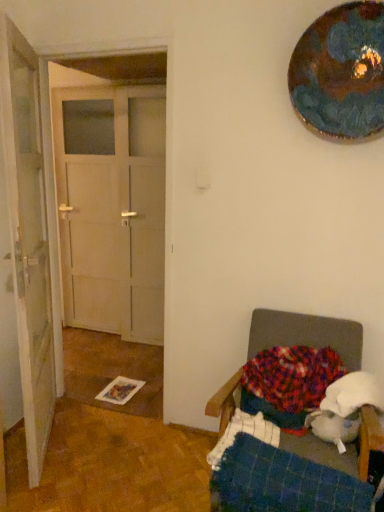
What do you see at coordinates (112, 213) in the screenshot? I see `white matte door at left, the second door viewed from the left` at bounding box center [112, 213].

This screenshot has height=512, width=384. What do you see at coordinates (341, 73) in the screenshot?
I see `metallic reflective plate at upper right` at bounding box center [341, 73].

What do you see at coordinates (276, 475) in the screenshot? I see `blue plaid blanket at lower right` at bounding box center [276, 475].

Identify the location of plush fabric chair at lower right. point(306,334).

This screenshot has width=384, height=512. In order to click on white matte door at left, the second door viewed from the left in this screenshot , I will do `click(112, 213)`.

Is point (294, 507) closer to camera compared to point (247, 406)?

Yes, point (294, 507) is closer to viewer.

Considering their positions, is blue plaid blanket at lower right located in front of or behind multicolored knitted blanket at lower right?

In the image, blue plaid blanket at lower right appears in front of multicolored knitted blanket at lower right.

Is blue plaid blanket at lower right facing towards multicolored knitted blanket at lower right?

No, blue plaid blanket at lower right is not facing towards multicolored knitted blanket at lower right.

From a real-world perspective, relative to multicolored knitted blanket at lower right, is blue plaid blanket at lower right vertically above or below?

From a real-world perspective, blue plaid blanket at lower right is physically below multicolored knitted blanket at lower right.

Consider the image. Is white wooden door at left, the second door in the right-to-left sequence, positioned with its back to white matte door at left, which is the 1th door from right to left?

Yes, white wooden door at left, the second door in the right-to-left sequence, is facing away from white matte door at left, which is the 1th door from right to left.

Is point (17, 184) closer to viewer compared to point (116, 252)?

Yes, it is in front of point (116, 252).

Considering the relative positions of white wooden door at left, the second door in the right-to-left sequence, and white matte door at left, which is the 1th door from right to left, in the image provided, is white wooden door at left, the second door in the right-to-left sequence, to the right of white matte door at left, which is the 1th door from right to left, from the viewer's perspective?

Incorrect, white wooden door at left, the second door in the right-to-left sequence, is not on the right side of white matte door at left, which is the 1th door from right to left.

Between white wooden door at left, the second door in the right-to-left sequence, and white matte door at left, which is the 1th door from right to left, which one has larger width?

Wider between the two is white wooden door at left, the second door in the right-to-left sequence.

In the scene shown: Visually, is metallic reflective plate at upper right positioned to the left or to the right of multicolored knitted blanket at lower right?

Based on their positions, metallic reflective plate at upper right is located to the right of multicolored knitted blanket at lower right.

Is metallic reflective plate at upper right not close to multicolored knitted blanket at lower right?

Absolutely, metallic reflective plate at upper right is distant from multicolored knitted blanket at lower right.

Considering the positions of point (373, 105) and point (247, 373), is point (373, 105) closer or farther from the camera than point (247, 373)?

Point (373, 105) is positioned closer to the camera compared to point (247, 373).

Consider the image. From the image's perspective, between metallic reflective plate at upper right and multicolored knitted blanket at lower right, which one is located above?

metallic reflective plate at upper right appears higher in the image.

Which is more to the right, white matte door at left, which is the 1th door from right to left, or metallic reflective plate at upper right?

metallic reflective plate at upper right.

Can you confirm if white matte door at left, which is the 1th door from right to left, is wider than metallic reflective plate at upper right?

Yes.

How different are the orientations of white matte door at left, which is the 1th door from right to left, and metallic reflective plate at upper right in degrees?

1.18 degrees separate the facing orientations of white matte door at left, which is the 1th door from right to left, and metallic reflective plate at upper right.

Is white matte door at left, the second door viewed from the left, bigger or smaller than metallic reflective plate at upper right?

Clearly, white matte door at left, the second door viewed from the left, is larger in size than metallic reflective plate at upper right.

Consider the image. From the image's perspective, is metallic reflective plate at upper right above white matte door at left, the second door viewed from the left?

Yes, from the image's perspective, metallic reflective plate at upper right is on top of white matte door at left, the second door viewed from the left.

Which of these two, metallic reflective plate at upper right or white matte door at left, the second door viewed from the left, is bigger?

white matte door at left, the second door viewed from the left.

Where is `door behind the metallic reflective plate at upper right`? The image size is (384, 512). door behind the metallic reflective plate at upper right is located at coordinates (112, 213).

Is metallic reflective plate at upper right far away from white matte door at left, the second door viewed from the left?

Yes, metallic reflective plate at upper right is far from white matte door at left, the second door viewed from the left.

Does plush fabric chair at lower right have a lesser height compared to white wooden door at left, the second door in the right-to-left sequence?

Yes, plush fabric chair at lower right is shorter than white wooden door at left, the second door in the right-to-left sequence.

Based on the photo, is plush fabric chair at lower right far from white wooden door at left, acting as the 1th door starting from the left?

plush fabric chair at lower right is positioned a significant distance from white wooden door at left, acting as the 1th door starting from the left.

Based on the photo, in the image, is plush fabric chair at lower right positioned in front of or behind white wooden door at left, the second door in the right-to-left sequence?

plush fabric chair at lower right is in front of white wooden door at left, the second door in the right-to-left sequence.

Is plush fabric chair at lower right inside or outside of white wooden door at left, the second door in the right-to-left sequence?

plush fabric chair at lower right is spatially situated outside white wooden door at left, the second door in the right-to-left sequence.

Is point (283, 367) farther from viewer compared to point (18, 201)?

Yes, point (283, 367) is farther from viewer.

Who is taller, multicolored knitted blanket at lower right or white wooden door at left, the second door in the right-to-left sequence?

white wooden door at left, the second door in the right-to-left sequence.

Does multicolored knitted blanket at lower right have a greater width compared to white wooden door at left, acting as the 1th door starting from the left?

Yes, multicolored knitted blanket at lower right is wider than white wooden door at left, acting as the 1th door starting from the left.

From a real-world perspective, is multicolored knitted blanket at lower right above or below white wooden door at left, acting as the 1th door starting from the left?

multicolored knitted blanket at lower right is situated lower than white wooden door at left, acting as the 1th door starting from the left, in the real world.

Find the location of a particular element. The width and height of the screenshot is (384, 512). blanket above the blue plaid blanket at lower right (from a real-world perspective) is located at coordinates (289, 378).

Find the location of a particular element. The width and height of the screenshot is (384, 512). door on the right of white wooden door at left, the second door in the right-to-left sequence is located at coordinates (112, 213).

Considering their positions, is white wooden door at left, acting as the 1th door starting from the left, positioned further to plush fabric chair at lower right than multicolored knitted blanket at lower right?

white wooden door at left, acting as the 1th door starting from the left.

Considering their positions, is multicolored knitted blanket at lower right positioned closer to white wooden door at left, acting as the 1th door starting from the left, than metallic reflective plate at upper right?

The object closer to white wooden door at left, acting as the 1th door starting from the left, is multicolored knitted blanket at lower right.

From the picture: When comparing their distances from white matte door at left, which is the 1th door from right to left, does blue plaid blanket at lower right or plush fabric chair at lower right seem closer?

plush fabric chair at lower right.

Which object lies nearer to the anchor point multicolored knitted blanket at lower right, plush fabric chair at lower right or white matte door at left, the second door viewed from the left?

plush fabric chair at lower right is positioned closer to the anchor multicolored knitted blanket at lower right.

Which object lies nearer to the anchor point white matte door at left, which is the 1th door from right to left, plush fabric chair at lower right or metallic reflective plate at upper right?

metallic reflective plate at upper right.

Which object lies nearer to the anchor point white wooden door at left, acting as the 1th door starting from the left, blue plaid blanket at lower right or metallic reflective plate at upper right?

blue plaid blanket at lower right.

Estimate the real-world distances between objects in this image. Which object is further from blue plaid blanket at lower right, metallic reflective plate at upper right or plush fabric chair at lower right?

metallic reflective plate at upper right.

Estimate the real-world distances between objects in this image. Which object is further from blue plaid blanket at lower right, white matte door at left, which is the 1th door from right to left, or metallic reflective plate at upper right?

white matte door at left, which is the 1th door from right to left, is positioned further to the anchor blue plaid blanket at lower right.

I want to click on chair between metallic reflective plate at upper right and blue plaid blanket at lower right vertically, so click(306, 334).

Locate an element on the screen. This screenshot has height=512, width=384. blanket that lies between metallic reflective plate at upper right and plush fabric chair at lower right from top to bottom is located at coordinates (289, 378).

Identify the location of chair located between white wooden door at left, acting as the 1th door starting from the left, and metallic reflective plate at upper right in the left-right direction. This screenshot has width=384, height=512. (306, 334).

At what (x,y) coordinates should I click in order to perform the action: click on chair between white matte door at left, the second door viewed from the left, and multicolored knitted blanket at lower right. Please return your answer as a coordinate pair (x, y). Looking at the image, I should click on (306, 334).